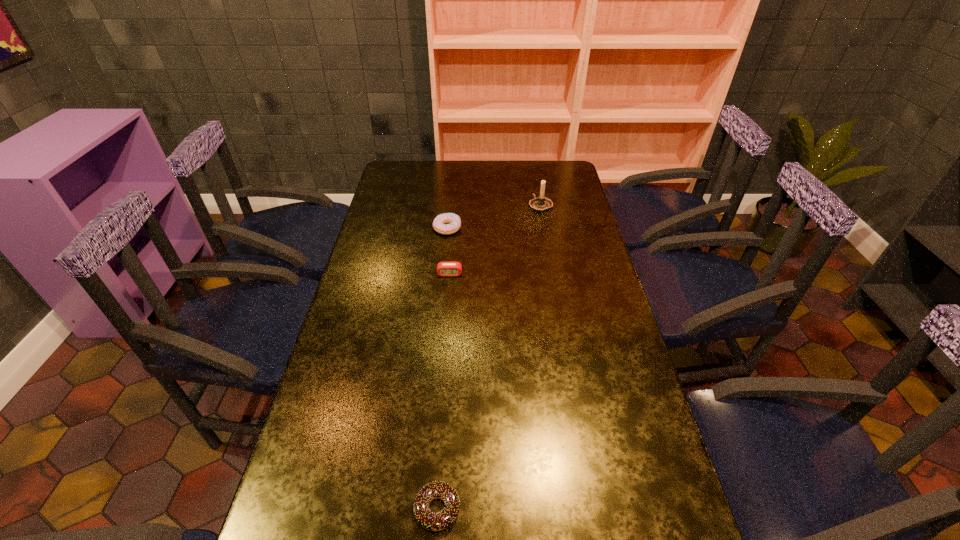
The image size is (960, 540). I want to click on vacant space that satisfies the following two spatial constraints: 1. on the front side of the third nearest object; 2. on the right side of the shorter doughnut, so click(x=420, y=509).